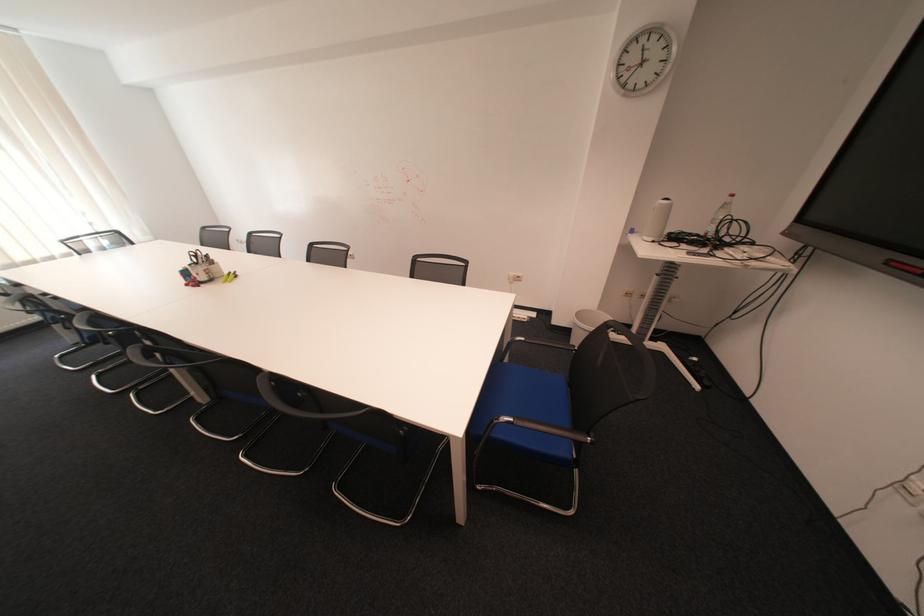
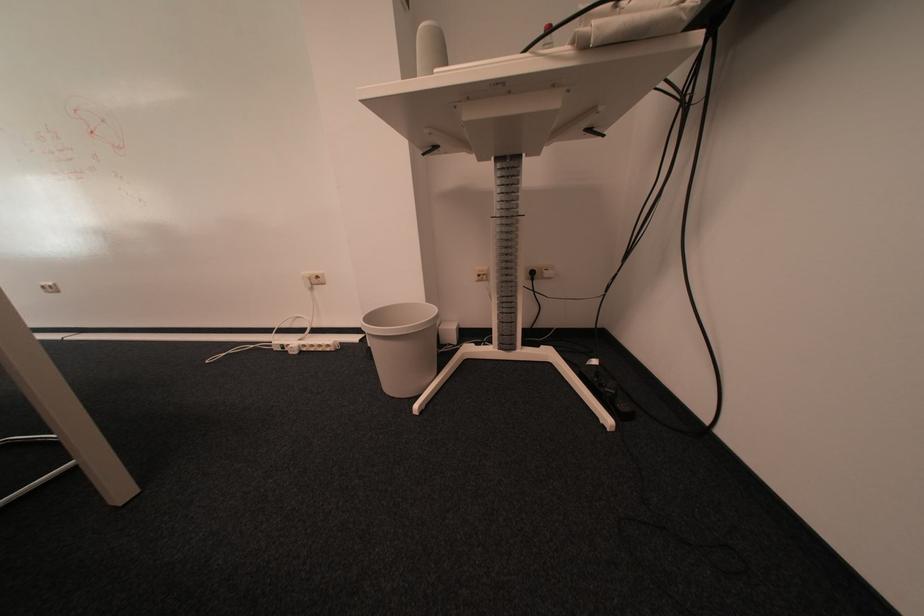
In a continuous first-person perspective shot, in which direction is the camera moving?

The movement direction of the cameraman is right, forward.